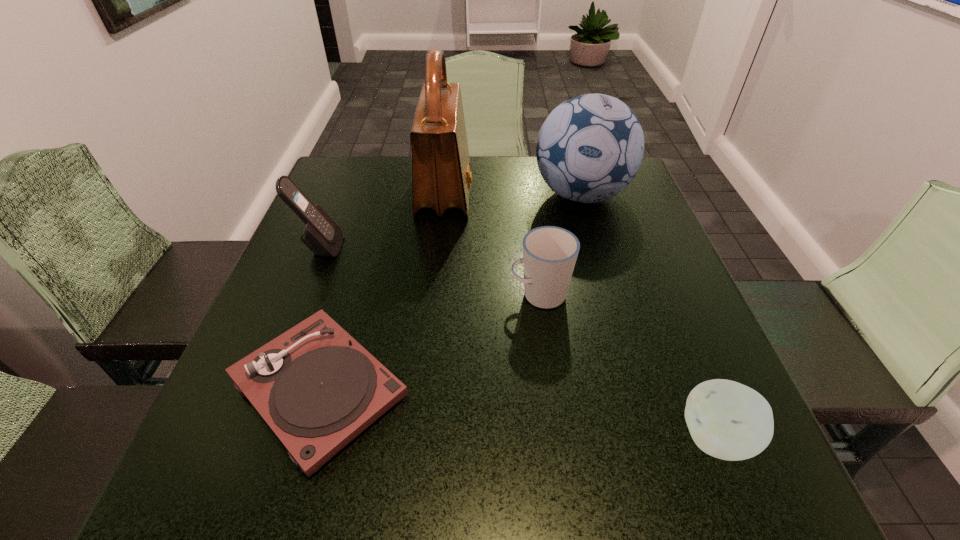
The width and height of the screenshot is (960, 540). Identify the location of vacant region located on the front-facing side of the cellular telephone. pyautogui.click(x=482, y=247).

Locate an element on the screen. This screenshot has width=960, height=540. vacant area situated 0.200m with a handle on the side of the third shortest object is located at coordinates (411, 295).

You are a GUI agent. You are given a task and a screenshot of the screen. Output one action in this format:
    pyautogui.click(x=<x>, y=<y>)
    Task: Click on the vacant space located 0.110m with a handle on the side of the third shortest object
    The image size is (960, 540).
    Given the screenshot: What is the action you would take?
    pyautogui.click(x=456, y=295)

I want to click on vacant area located with a handle on the side of the third shortest object, so click(x=332, y=295).

Where is `vacant space situated 0.110m on the back of the second shortest object`? vacant space situated 0.110m on the back of the second shortest object is located at coordinates (681, 350).

Identify the location of vacant space situated 0.180m on the right of the phonograph_record. This screenshot has width=960, height=540. (517, 388).

Locate an element on the screen. This screenshot has height=540, width=960. shoulder bag that is positioned at the far edge is located at coordinates (441, 178).

At what (x,y) coordinates should I click in order to perform the action: click on soccer ball that is at the far edge. Please return your answer as a coordinate pair (x, y). The width and height of the screenshot is (960, 540). Looking at the image, I should click on (590, 147).

I want to click on apple present at the near edge, so click(x=727, y=420).

Find the location of a particular element. This screenshot has width=960, height=540. phonograph_record located in the near edge section of the desktop is located at coordinates (317, 388).